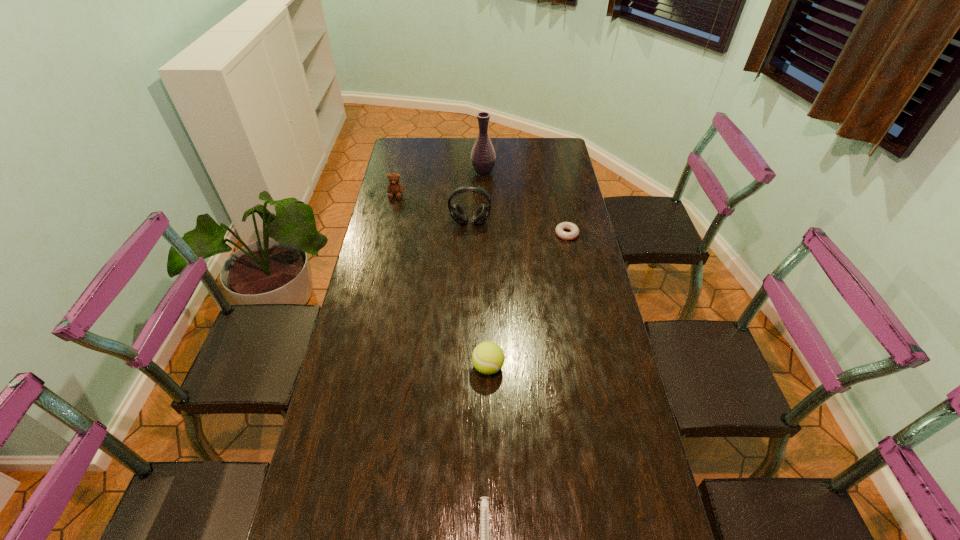
In order to click on vase in this screenshot , I will do `click(483, 158)`.

What are the coordinates of `the tallest object` in the screenshot? It's located at (483, 158).

What are the coordinates of `headset` in the screenshot? It's located at coord(457,213).

You are a GUI agent. You are given a task and a screenshot of the screen. Output one action in this format:
    pyautogui.click(x=<x>, y=<y>)
    Task: Click on the second farthest object
    This screenshot has height=540, width=960.
    Given the screenshot: What is the action you would take?
    pyautogui.click(x=394, y=188)

Where is `the leftmost object`? The height and width of the screenshot is (540, 960). the leftmost object is located at coordinates (394, 188).

Find the location of a particular element. the fifth farthest object is located at coordinates (488, 357).

Where is `doughnut`? doughnut is located at coordinates (574, 233).

Locate an element on the screen. The width and height of the screenshot is (960, 540). the fifth tallest object is located at coordinates (574, 233).

Where is `vacant space located on the back of the farthest object`? This screenshot has width=960, height=540. vacant space located on the back of the farthest object is located at coordinates (483, 155).

At what (x,y) coordinates should I click in order to perform the action: click on vacant space located on the earcups of the fifth shortest object. Please return your answer as a coordinate pair (x, y). Looking at the image, I should click on (468, 282).